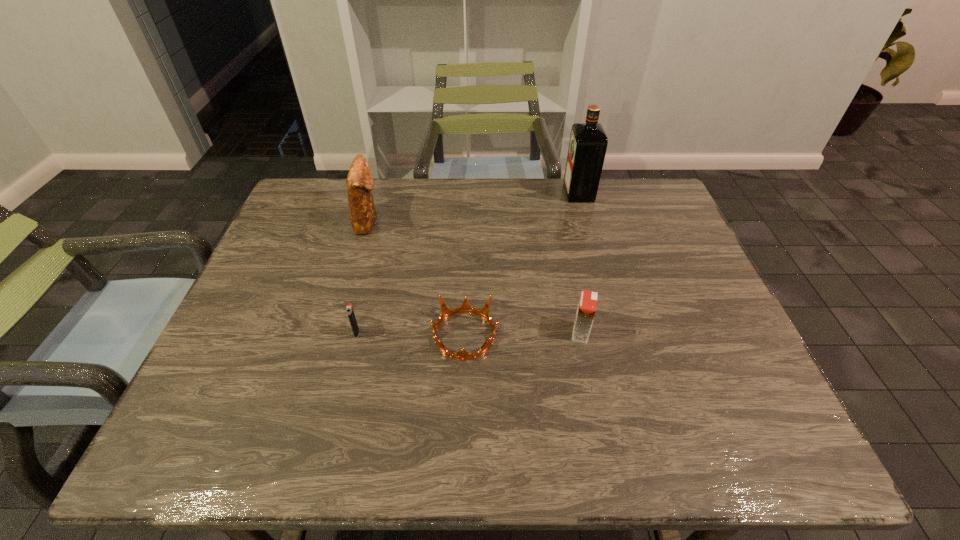
I want to click on vacant region between the liquor and the fourth object from left to right, so click(x=580, y=263).

In order to click on blank region between the orange juice and the liquor in this screenshot , I will do `click(580, 263)`.

The height and width of the screenshot is (540, 960). Identify the location of blank region between the rightmost object and the igniter. (468, 262).

Where is `empty space between the orange juice and the rightmost object`? The width and height of the screenshot is (960, 540). empty space between the orange juice and the rightmost object is located at coordinates (580, 263).

What are the coordinates of `unoccupied position between the shortest object and the second tallest object` in the screenshot? It's located at (416, 278).

Identify which object is the second closest to the second tallest object. Please provide its 2D coordinates. Your answer should be formatted as a tuple, i.e. [(x, y)], where the tuple contains the x and y coordinates of a point satisfying the conditions above.

[(465, 307)]

Where is `the fourth closest object to the fourth object from left to right`? The height and width of the screenshot is (540, 960). the fourth closest object to the fourth object from left to right is located at coordinates (359, 181).

What are the coordinates of `free point that satisfies the following two spatial constraints: 1. on the open side of the second shortest object; 2. on the left side of the fourth shortest object` in the screenshot? It's located at (335, 332).

Image resolution: width=960 pixels, height=540 pixels. Identify the location of free point that satisfies the following two spatial constraints: 1. on the open side of the second object from left to right; 2. on the right side of the fourth nearest object. (335, 332).

The image size is (960, 540). What are the coordinates of `vacant space that satisfies the following two spatial constraints: 1. on the open side of the fourth nearest object; 2. on the left side of the second object from left to right` in the screenshot? It's located at (335, 332).